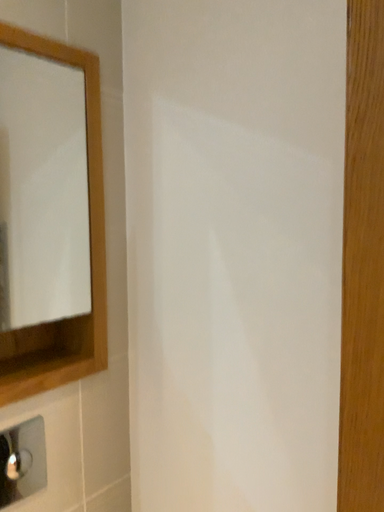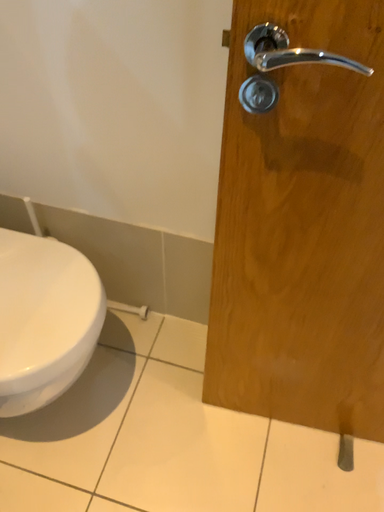
Question: How did the camera likely rotate when shooting the video?

Choices:
 (A) rotated upward
 (B) rotated downward

Answer: (B)